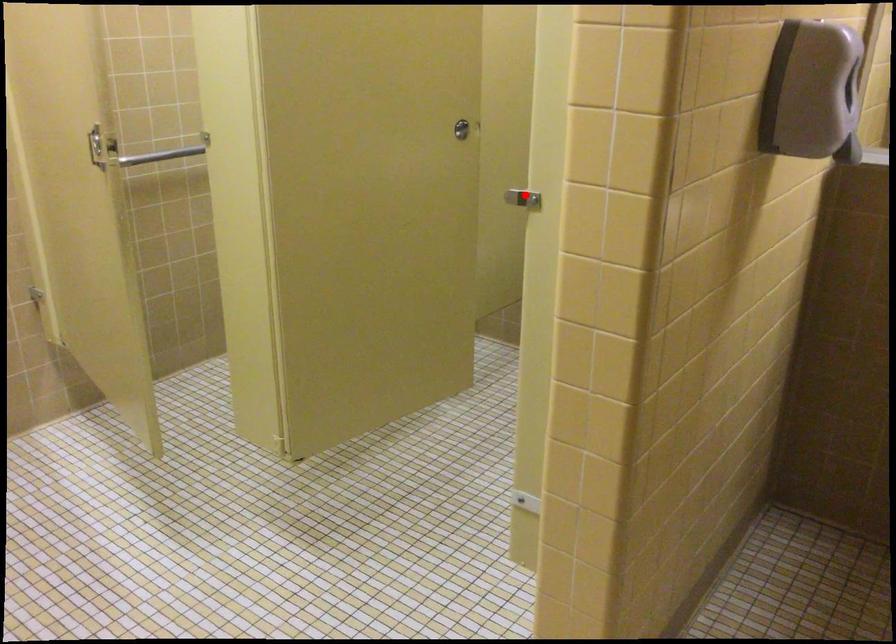
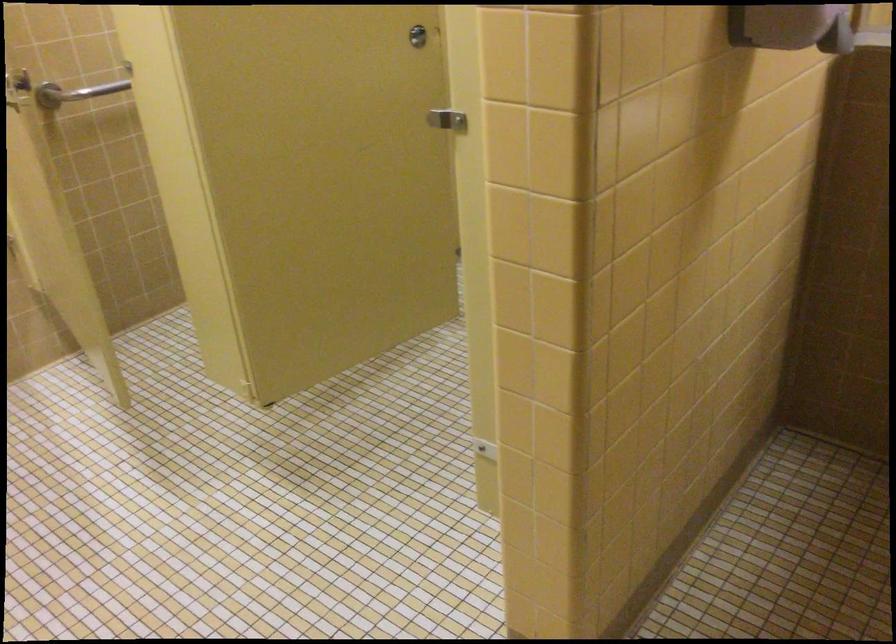
Question: I am providing you with two images of the same scene from different viewpoints. In image1, a red point is highlighted. Considering the same 3D point in image2, which of the following is correct?

Choices:
 (A) It is closer
 (B) It is farther

Answer: (A)